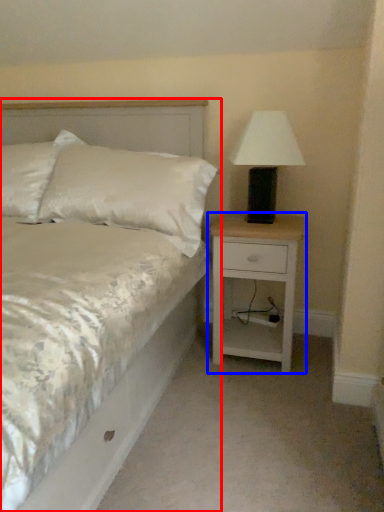
Question: Among these objects, which one is farthest to the camera, bed (highlighted by a red box) or nightstand (highlighted by a blue box)?

Choices:
 (A) bed
 (B) nightstand

Answer: (B)